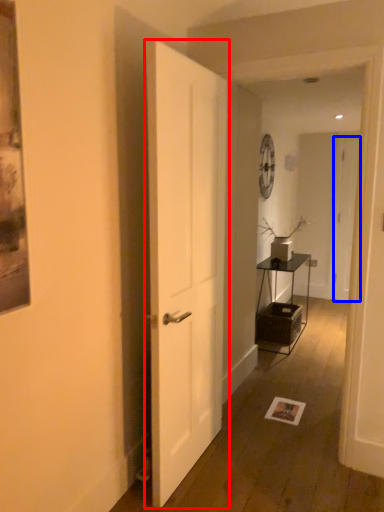
Question: Among these objects, which one is farthest to the camera, door (highlighted by a red box) or door (highlighted by a blue box)?

Choices:
 (A) door
 (B) door

Answer: (B)